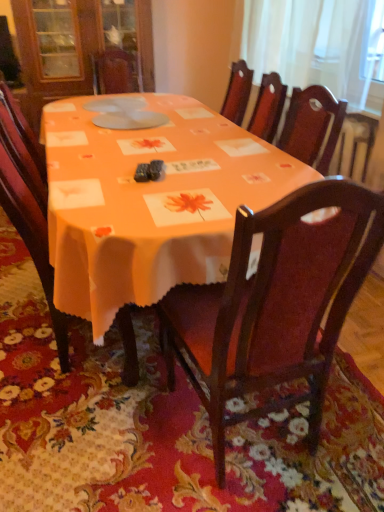
You are a GUI agent. You are given a task and a screenshot of the screen. Output one action in this format:
    pyautogui.click(x=<x>, y=<y>)
    Task: Click on the spots to the right of wooden chair at center, the 2th chair when ordered from left to right
    
    Given the screenshot: What is the action you would take?
    pyautogui.click(x=350, y=426)